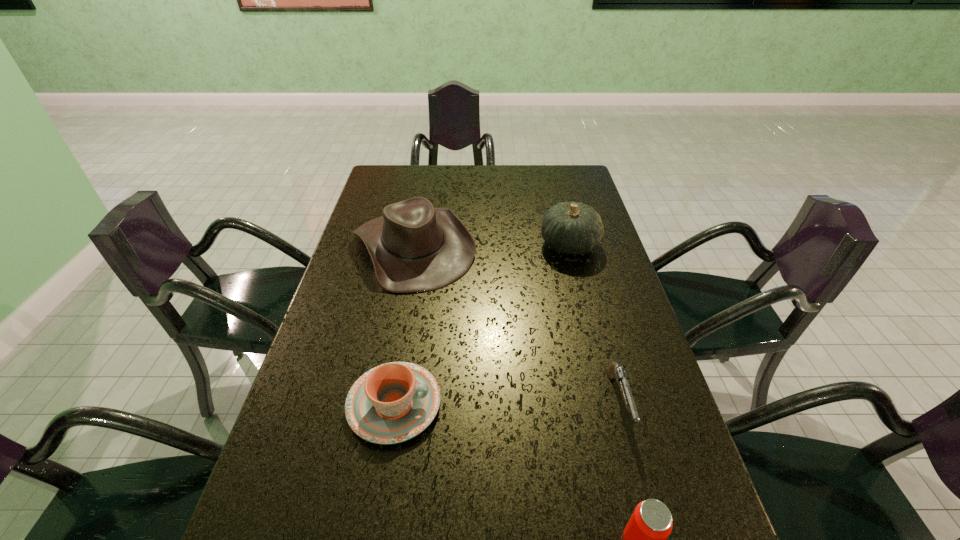
At what (x,y) coordinates should I click in order to perform the action: click on the third closest object to the chinaware. Please return your answer as a coordinate pair (x, y). The image size is (960, 540). Looking at the image, I should click on (614, 371).

Select which object appears as the third closest to the gourd. Please provide its 2D coordinates. Your answer should be formatted as a tuple, i.e. [(x, y)], where the tuple contains the x and y coordinates of a point satisfying the conditions above.

[(394, 402)]